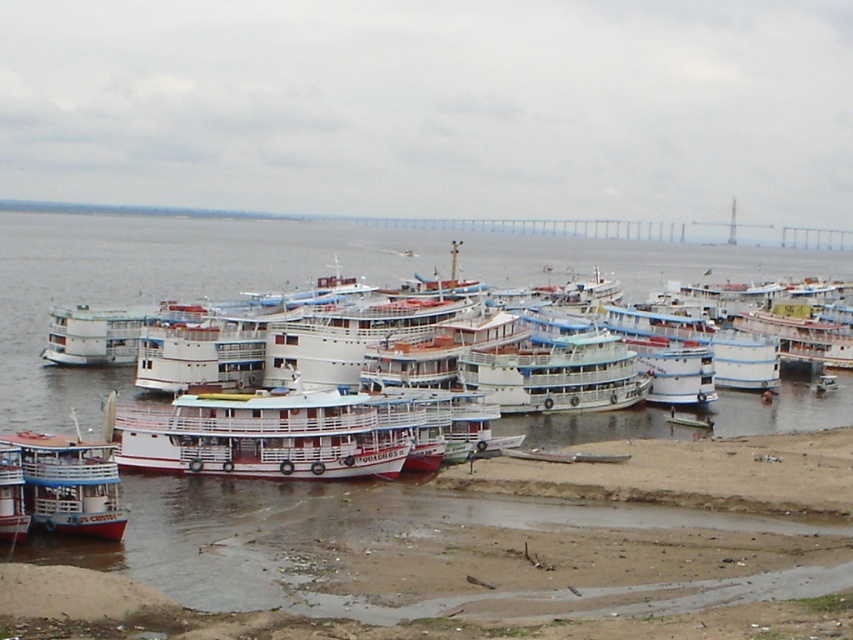
Question: Considering the relative positions of white matte boat at center and white glossy boat at lower left in the image provided, where is white matte boat at center located with respect to white glossy boat at lower left?

Choices:
 (A) below
 (B) above

Answer: (B)

Question: Which object is farther from the camera taking this photo?

Choices:
 (A) white matte boat at center
 (B) white glossy boat at lower left

Answer: (A)

Question: In this image, where is white matte boat at center located relative to white glossy boat at lower left?

Choices:
 (A) right
 (B) left

Answer: (A)

Question: In this image, where is white matte boat at center located relative to white glossy boat at lower left?

Choices:
 (A) left
 (B) right

Answer: (B)

Question: Which point is farther to the camera?

Choices:
 (A) white matte boat at center
 (B) white glossy boat at lower left

Answer: (A)